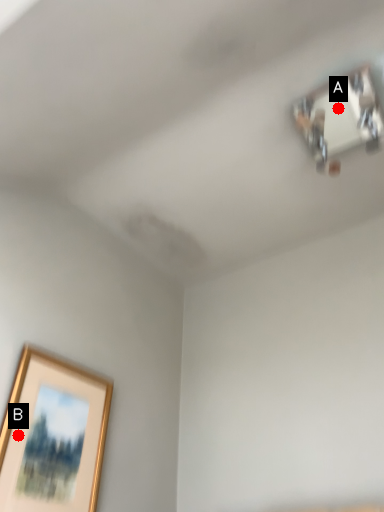
Question: Two points are circled on the image, labeled by A and B beside each circle. Which point is closer to the camera taking this photo?

Choices:
 (A) A is closer
 (B) B is closer

Answer: (B)